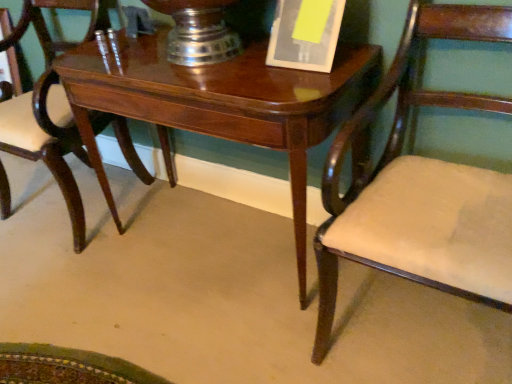
Find the location of a particular element. The width and height of the screenshot is (512, 384). vacant space in front of glossy wood table at center is located at coordinates (191, 330).